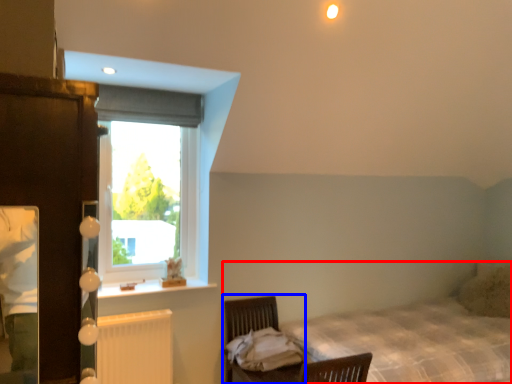
Question: Which of the following is the farthest to the observer, bed (highlighted by a red box) or swivel chair (highlighted by a blue box)?

Choices:
 (A) bed
 (B) swivel chair

Answer: (B)